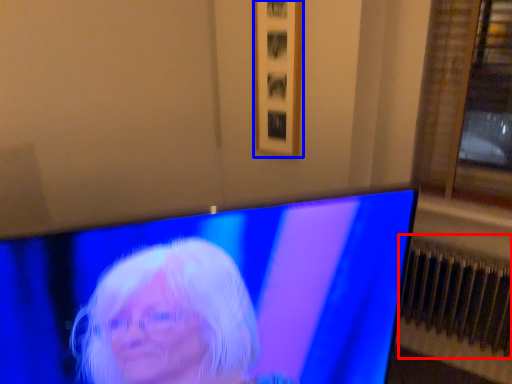
Question: Which object is closer to the camera taking this photo, radiator (highlighted by a red box) or picture frame (highlighted by a blue box)?

Choices:
 (A) radiator
 (B) picture frame

Answer: (A)